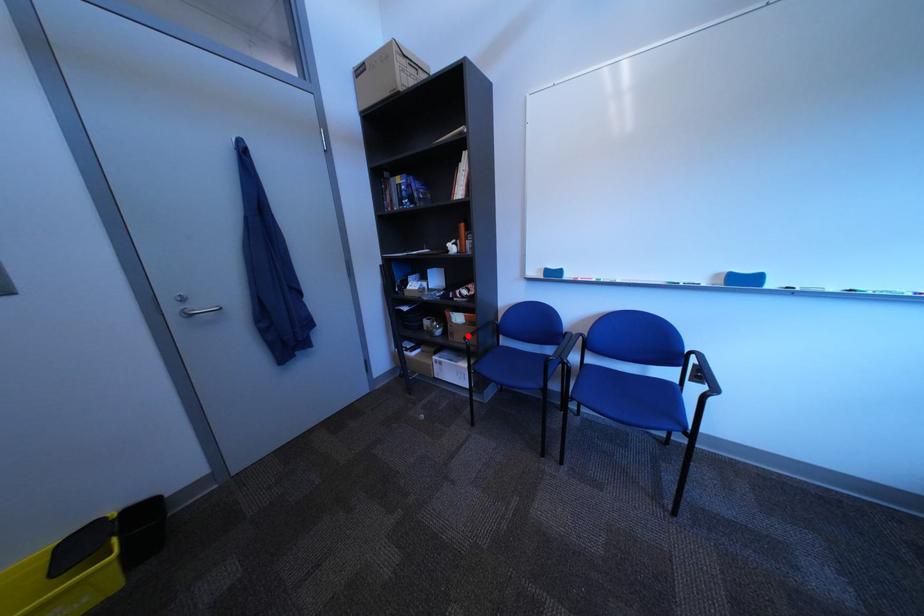
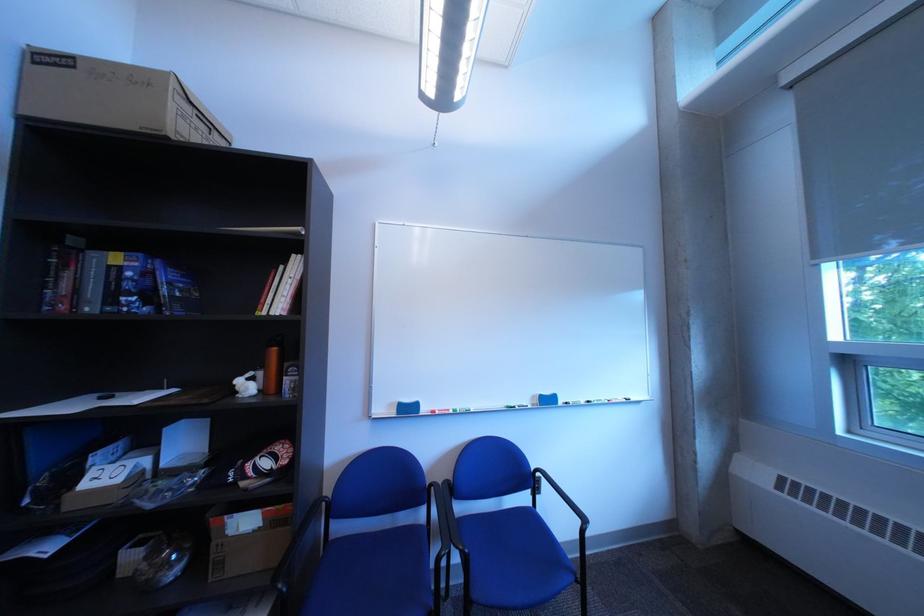
Where in the second image is the point corresponding to the highlighted location from the first image?

(237, 565)